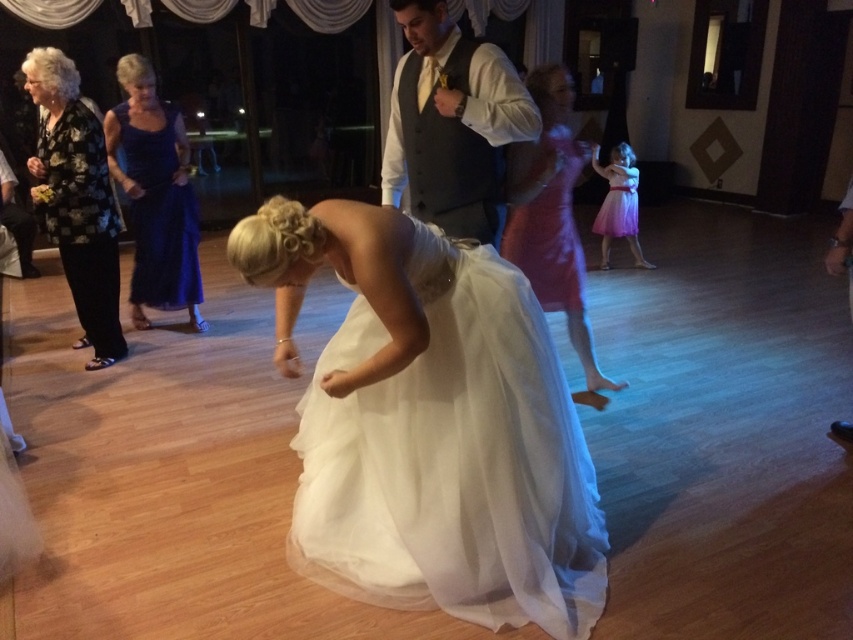
Can you confirm if white tulle dress at center is smaller than matte gray vest at center?

No.

Does point (323, 516) come closer to viewer compared to point (466, 186)?

Yes, it is in front of point (466, 186).

Does point (337, 492) lie behind point (488, 77)?

No, (337, 492) is in front of (488, 77).

Locate an element on the screen. This screenshot has width=853, height=640. white tulle dress at center is located at coordinates (430, 424).

Does matte pink dress at center have a lesser width compared to purple tulle dress at right?

Incorrect, matte pink dress at center's width is not less than purple tulle dress at right's.

Describe the element at coordinates (550, 214) in the screenshot. I see `matte pink dress at center` at that location.

Where is `matte pink dress at center`? The width and height of the screenshot is (853, 640). matte pink dress at center is located at coordinates (550, 214).

This screenshot has width=853, height=640. I want to click on blue satin dress at upper left, so click(x=155, y=195).

Can you confirm if blue satin dress at upper left is wider than matte white dress at right?

No.

Locate an element on the screen. The width and height of the screenshot is (853, 640). blue satin dress at upper left is located at coordinates (155, 195).

This screenshot has height=640, width=853. I want to click on blue satin dress at upper left, so click(x=155, y=195).